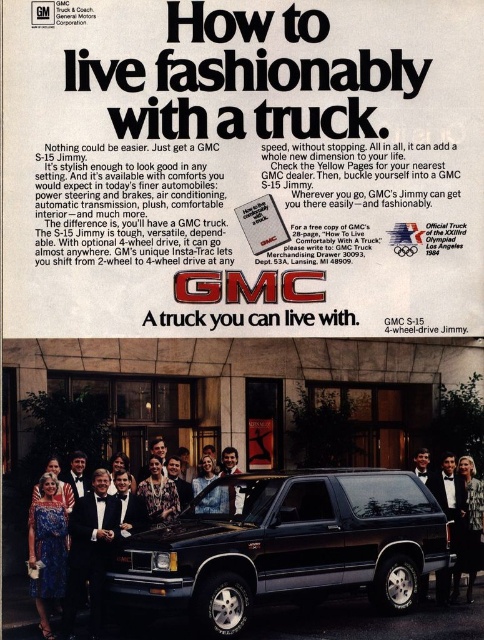
You are attending a formal event and see a GMC S15 Jimmy truck advertisement with a floral dress at center and a black tuxedo at center. Which clothing item is positioned to the left in the ad?

The floral dress at center is positioned to the left of the black tuxedo at center in the advertisement.

You are attending a formal event and see both the blue satin dress at lower left and the silky black dress at lower right in the advertisement. Which dress is positioned lower on the page?

The blue satin dress at lower left is positioned lower on the page than the silky black dress at lower right.

In the GMC S15 Jimmy truck advertisement, there are two points marked at coordinates point (x=50, y=593) and point (x=470, y=541). From your perspective as an observer looking at the ad, which of these two points appears closer to you?

Point (x=50, y=593) is closer to the viewer than point (x=470, y=541).